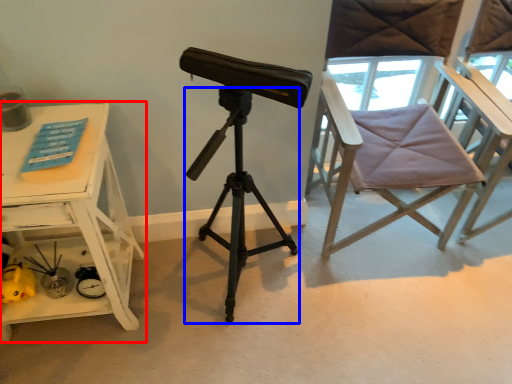
Question: Which point is closer to the camera, table (highlighted by a red box) or tripod (highlighted by a blue box)?

Choices:
 (A) table
 (B) tripod

Answer: (B)